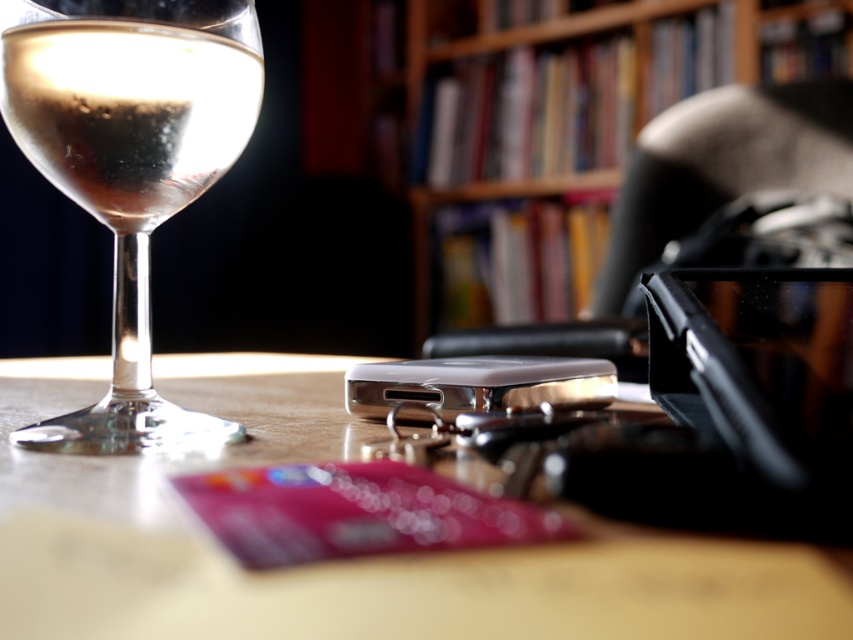
Based on the photo, you are standing at the point marked by the coordinates point (x=618, y=131). You want to reach the wooden bookcase at upper center. Can you walk directly to it from your current position?

The point (x=618, y=131) indicates the wooden bookcase at upper center, so you are already at the wooden bookcase at upper center.

You are organizing items on a table and need to place a new item between the wooden bookcase at upper center and the clear glass wine at left. Based on their widths, which side should you place the new item closer to?

The wooden bookcase at upper center might be wider than clear glass wine at left, so you should place the new item closer to the clear glass wine at left to ensure enough space.

You are arranging items on a table and want to place a decorative item between the wooden bookcase at upper center and the clear glass wine at left. Considering their sizes, which object should you place closer to the edge of the table to ensure stability?

The wooden bookcase at upper center is much taller than the clear glass wine at left, so placing it closer to the edge of the table would provide better stability due to its height and weight distribution.